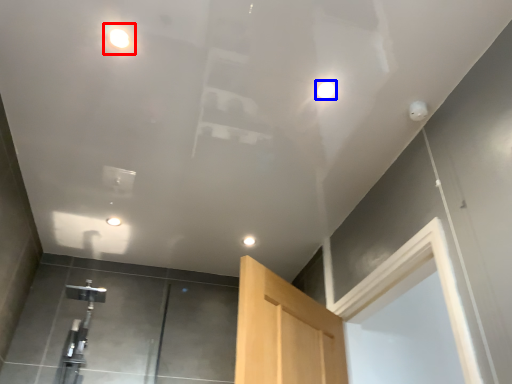
Question: Which point is closer to the camera, droplight (highlighted by a red box) or droplight (highlighted by a blue box)?

Choices:
 (A) droplight
 (B) droplight

Answer: (A)